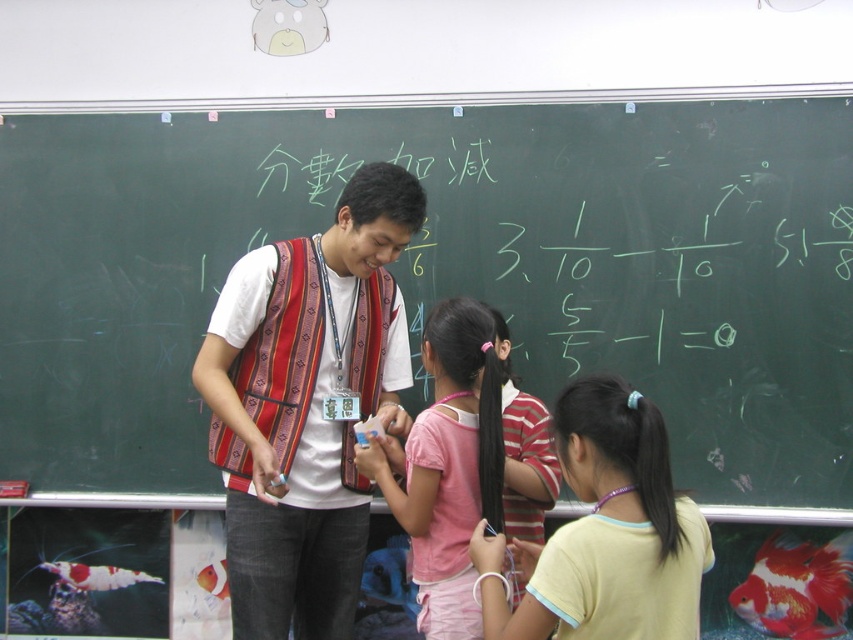
Question: Which point is farther from the camera taking this photo?

Choices:
 (A) 427,342
 (B) 178,376

Answer: (B)

Question: Does green chalkboard at center have a larger size compared to pink fabric hair tie at center?

Choices:
 (A) yes
 (B) no

Answer: (A)

Question: Is green chalkboard at center bigger than yellow cotton shirt at lower right?

Choices:
 (A) yes
 (B) no

Answer: (A)

Question: Which of the following is the farthest from the observer?

Choices:
 (A) (643, 403)
 (B) (463, 413)
 (C) (531, 538)

Answer: (C)

Question: Which point is farther to the camera?

Choices:
 (A) [x=814, y=99]
 (B) [x=431, y=355]

Answer: (A)

Question: Is yellow cotton shirt at lower right bigger than pink fabric shirt at center?

Choices:
 (A) yes
 (B) no

Answer: (A)